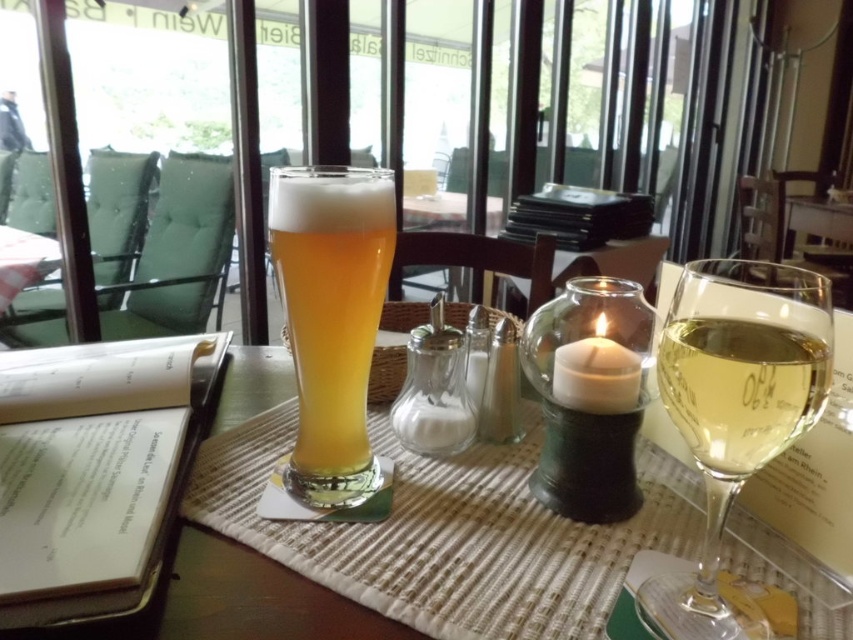
Question: Does clear glass table at center appear under golden glass beer at center?

Choices:
 (A) no
 (B) yes

Answer: (B)

Question: Which point appears closest to the camera in this image?

Choices:
 (A) (686, 348)
 (B) (349, 298)
 (C) (685, 392)

Answer: (A)

Question: Which point is closer to the camera?

Choices:
 (A) pos(469,624)
 (B) pos(781,451)

Answer: (B)

Question: Does clear glass table at center appear on the left side of translucent glass wine at right?

Choices:
 (A) no
 (B) yes

Answer: (B)

Question: Which object is the closest to the golden glass beer at center?

Choices:
 (A) clear glass table at center
 (B) transparent glass at right
 (C) translucent glass wine at right

Answer: (A)

Question: Observing the image, what is the correct spatial positioning of clear glass table at center in reference to translucent glass wine at right?

Choices:
 (A) left
 (B) right

Answer: (A)